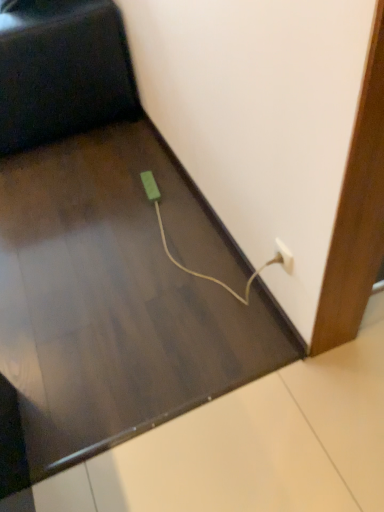
Identify the location of white plastic plug at lower right. The image size is (384, 512). (283, 256).

Find the location of a particular element. white plastic plug at lower right is located at coordinates (283, 256).

From a real-world perspective, which object rests below the other?

green matte plug at lower center, from a real-world perspective.

Considering the positions of objects green matte plug at lower center and white plastic plug at lower right in the image provided, who is behind, green matte plug at lower center or white plastic plug at lower right?

Positioned behind is green matte plug at lower center.

Locate an element on the screen. The image size is (384, 512). socket behind the white plastic plug at lower right is located at coordinates (150, 186).

Is green matte plug at lower center looking in the opposite direction of white plastic plug at lower right?

No, white plastic plug at lower right is not at the back of green matte plug at lower center.

Is black matte chair at upper left facing away from white plastic plug at lower right?

No, black matte chair at upper left is not facing the opposite direction of white plastic plug at lower right.

Does point (11, 138) lie in front of point (280, 247)?

That is False.

Is black matte chair at upper left not inside white plastic plug at lower right?

Yes, black matte chair at upper left is located beyond the bounds of white plastic plug at lower right.

Does black matte chair at upper left have a lesser height compared to white plastic plug at lower right?

No.

From a real-world perspective, which object rests below the other?

white plastic plug at lower right, from a real-world perspective.

Is white plastic plug at lower right oriented towards black matte chair at upper left?

No, white plastic plug at lower right does not turn towards black matte chair at upper left.

In the scene shown: Is white plastic plug at lower right closer to the viewer compared to black matte chair at upper left?

Yes.

From the image's perspective, is white plastic plug at lower right located above or below black matte chair at upper left?

Clearly, from the image's perspective, white plastic plug at lower right is below black matte chair at upper left.

Is white plastic plug at lower right positioned behind green matte plug at lower center?

No.

Can you tell me how much white plastic plug at lower right and green matte plug at lower center differ in facing direction?

6.75 degrees.

From the image's perspective, which object appears higher, white plastic plug at lower right or green matte plug at lower center?

From the image's view, green matte plug at lower center is above.

Is point (155, 190) closer or farther from the camera than point (69, 93)?

Point (155, 190) appears to be closer to the viewer than point (69, 93).

From the image's perspective, between green matte plug at lower center and black matte chair at upper left, who is located below?

green matte plug at lower center.

Is green matte plug at lower center taller than black matte chair at upper left?

In fact, green matte plug at lower center may be shorter than black matte chair at upper left.

Is green matte plug at lower center behind black matte chair at upper left?

Yes, it is.

The height and width of the screenshot is (512, 384). In order to click on socket to the right of black matte chair at upper left in this screenshot , I will do `click(150, 186)`.

Could you tell me if black matte chair at upper left is facing green matte plug at lower center?

No, black matte chair at upper left does not turn towards green matte plug at lower center.

Considering the sizes of objects black matte chair at upper left and green matte plug at lower center in the image provided, who is smaller, black matte chair at upper left or green matte plug at lower center?

green matte plug at lower center.

Where is `socket below the white plastic plug at lower right (from a real-world perspective)`? socket below the white plastic plug at lower right (from a real-world perspective) is located at coordinates (150, 186).

The image size is (384, 512). I want to click on furniture above the white plastic plug at lower right (from the image's perspective), so click(61, 70).

Based on their spatial positions, is green matte plug at lower center or black matte chair at upper left further from white plastic plug at lower right?

black matte chair at upper left is further to white plastic plug at lower right.

Based on their spatial positions, is white plastic plug at lower right or green matte plug at lower center further from black matte chair at upper left?

Based on the image, white plastic plug at lower right appears to be further to black matte chair at upper left.

Estimate the real-world distances between objects in this image. Which object is closer to green matte plug at lower center, white plastic plug at lower right or black matte chair at upper left?

Based on the image, black matte chair at upper left appears to be nearer to green matte plug at lower center.

From the image, which object appears to be farther from white plastic plug at lower right, black matte chair at upper left or green matte plug at lower center?

black matte chair at upper left.

Estimate the real-world distances between objects in this image. Which object is closer to black matte chair at upper left, green matte plug at lower center or white plastic plug at lower right?

green matte plug at lower center is closer to black matte chair at upper left.

Looking at the image, which one is located closer to green matte plug at lower center, black matte chair at upper left or white plastic plug at lower right?

black matte chair at upper left is closer to green matte plug at lower center.

Where is `socket between black matte chair at upper left and white plastic plug at lower right in the up-down direction`? Image resolution: width=384 pixels, height=512 pixels. socket between black matte chair at upper left and white plastic plug at lower right in the up-down direction is located at coordinates (150, 186).